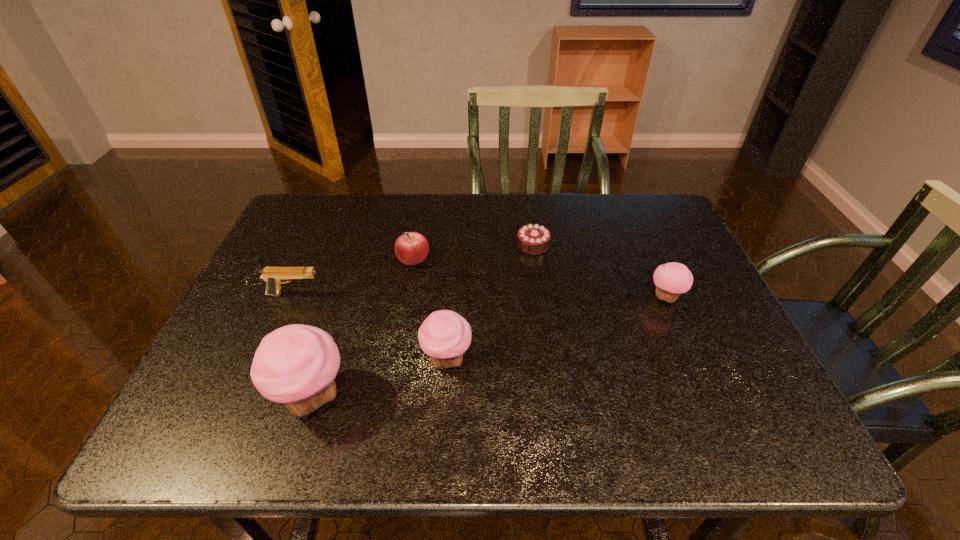
In order to click on free space between the apple and the pistol in this screenshot , I will do pos(354,276).

This screenshot has height=540, width=960. What are the coordinates of `vacant area that lies between the apple and the tallest object` in the screenshot? It's located at (363, 328).

The height and width of the screenshot is (540, 960). Find the location of `empty space between the apple and the rightmost cupcake`. empty space between the apple and the rightmost cupcake is located at coordinates (540, 278).

Locate an element on the screen. This screenshot has height=540, width=960. vacant area that lies between the fourth object from right to left and the pistol is located at coordinates (354, 276).

Where is `free space between the shortest object and the second cupcake from left to right`? free space between the shortest object and the second cupcake from left to right is located at coordinates (490, 302).

I want to click on blank region between the shortest cupcake and the apple, so click(540, 278).

I want to click on empty space that is in between the shortest object and the apple, so click(x=473, y=252).

Choose which object is the nearest neighbor to the rightmost object. Please provide its 2D coordinates. Your answer should be formatted as a tuple, i.e. [(x, y)], where the tuple contains the x and y coordinates of a point satisfying the conditions above.

[(533, 239)]

Where is `object that is the closest to the shortest cupcake`? The width and height of the screenshot is (960, 540). object that is the closest to the shortest cupcake is located at coordinates (533, 239).

Identify which cupcake is located as the second nearest to the second tallest object. Please provide its 2D coordinates. Your answer should be formatted as a tuple, i.e. [(x, y)], where the tuple contains the x and y coordinates of a point satisfying the conditions above.

[(671, 279)]